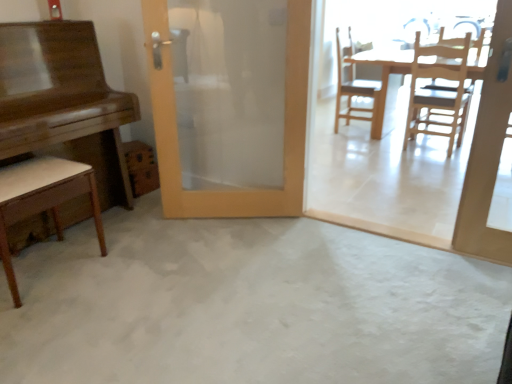
You are a GUI agent. You are given a task and a screenshot of the screen. Output one action in this format:
    pyautogui.click(x=<x>, y=<y>)
    Task: Click on the free spot to the right of light brown wood chair at lower left, which ranks as the 3th chair in back-to-front order
    
    Given the screenshot: What is the action you would take?
    tap(115, 274)